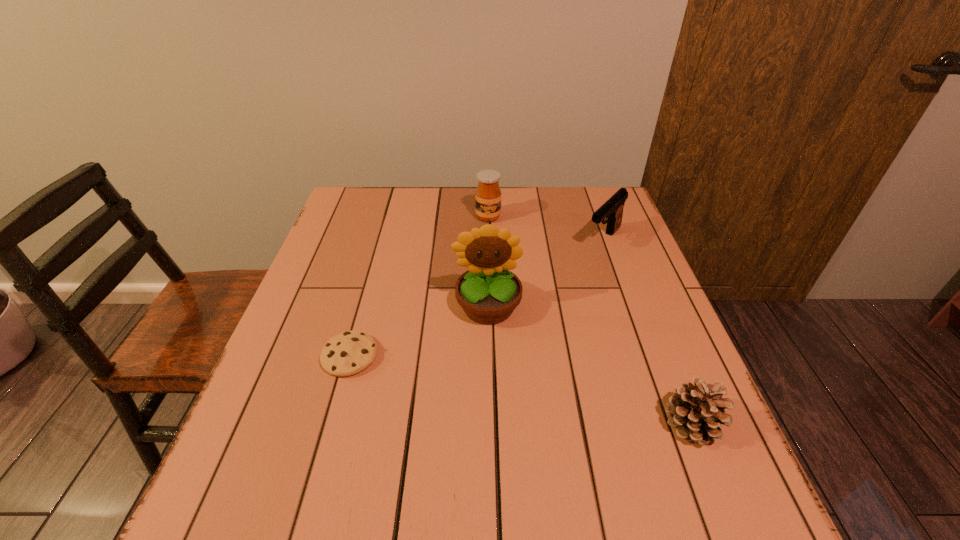
Identify the location of the leftmost object. (350, 352).

You are a GUI agent. You are given a task and a screenshot of the screen. Output one action in this format:
    pyautogui.click(x=<x>, y=<y>)
    Task: Click on the shortest object
    The height and width of the screenshot is (540, 960).
    Given the screenshot: What is the action you would take?
    pyautogui.click(x=350, y=352)

Where is `pinecone`? This screenshot has width=960, height=540. pinecone is located at coordinates (697, 411).

Image resolution: width=960 pixels, height=540 pixels. Identify the location of the fourth tallest object. (697, 411).

The height and width of the screenshot is (540, 960). I want to click on the farthest object, so click(488, 194).

Where is `the tallest object`? The width and height of the screenshot is (960, 540). the tallest object is located at coordinates (488, 292).

Locate an element on the screen. sunflower is located at coordinates (488, 292).

Identify the location of the fourth nearest object. The height and width of the screenshot is (540, 960). (612, 209).

Image resolution: width=960 pixels, height=540 pixels. In order to click on free region located 0.090m on the left of the shortest object in this screenshot , I will do `click(280, 356)`.

You are a GUI agent. You are given a task and a screenshot of the screen. Output one action in this format:
    pyautogui.click(x=<x>, y=<y>)
    Task: Click on the blank area located on the left of the pinecone
    
    Given the screenshot: What is the action you would take?
    pyautogui.click(x=627, y=423)